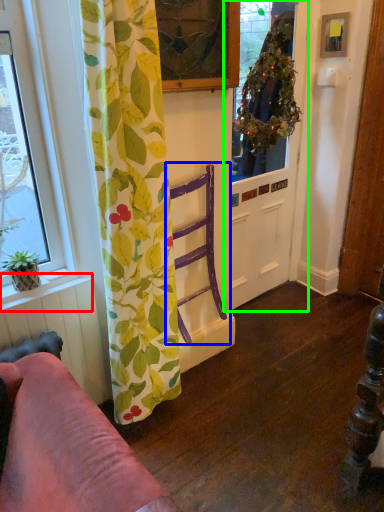
Question: Considering the real-world distances, which object is farthest from window sill (highlighted by a red box)? armchair (highlighted by a blue box) or door (highlighted by a green box)?

Choices:
 (A) armchair
 (B) door

Answer: (B)